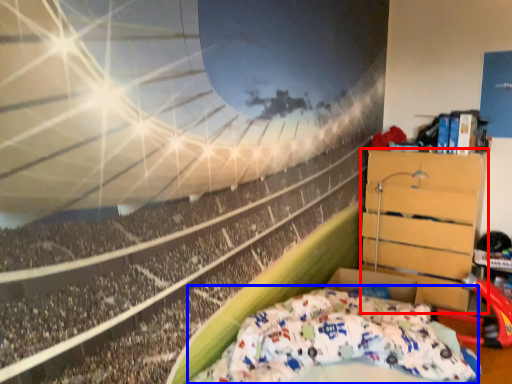
Question: Which of the following is the closest to the observer, furniture (highlighted by a red box) or bed (highlighted by a blue box)?

Choices:
 (A) furniture
 (B) bed

Answer: (B)